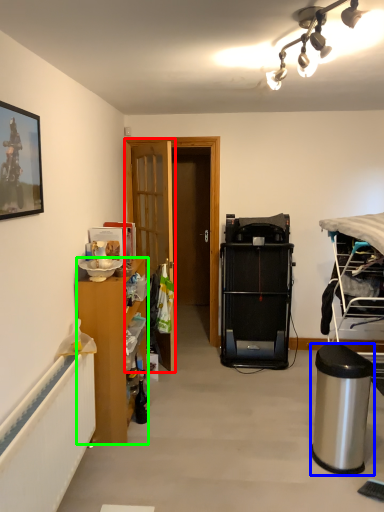
Question: Estimate the real-world distances between objects in this image. Which object is farther from door (highlighted by a red box), trash bin/can (highlighted by a blue box) or cabinetry (highlighted by a green box)?

Choices:
 (A) trash bin/can
 (B) cabinetry

Answer: (A)